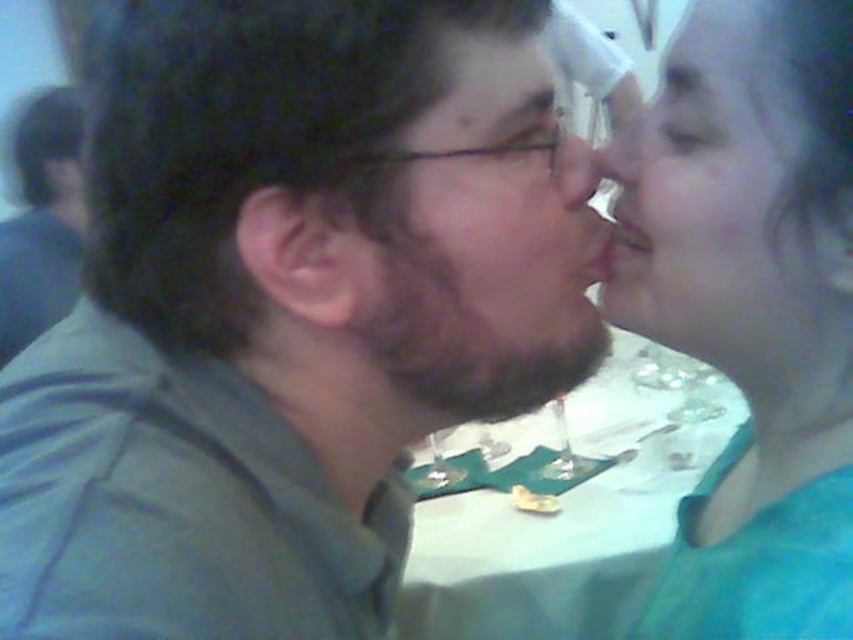
You are a photographer trying to capture a candid shot of the smooth skin face at upper right and the smooth skin nose at center. Since you want to focus on the face, which object should you adjust your camera to prioritize in the foreground?

The smooth skin face at upper right is in front of the smooth skin nose at center, so you should prioritize focusing on the smooth skin face at upper right to ensure it remains sharp in the foreground.

You are a photographer at a social event and notice two people kissing. You see the matte green shirt at center and the smooth teal shirt at right. Which shirt is closer to your camera?

The matte green shirt at center is closer to your camera because it is in front of the smooth teal shirt at right.

You are a photographer reviewing the image to ensure all subjects are properly framed. You notice the smooth skin face at upper right and the smooth skin nose at center. Which of these two elements is positioned lower in the image?

The smooth skin face at upper right is positioned below the smooth skin nose at center, so the smooth skin face at upper right is lower in the image.